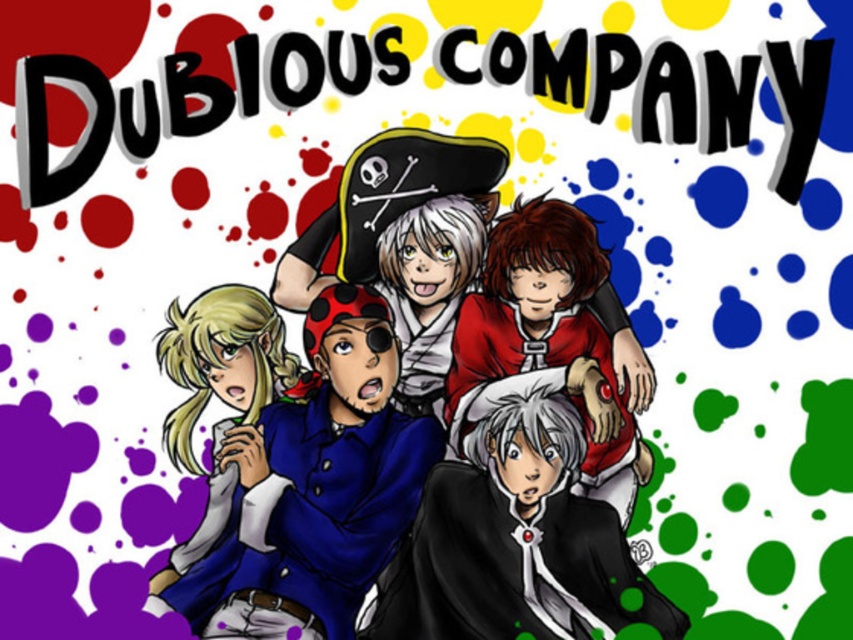
Which is in front, point (440, 429) or point (218, 326)?

Point (218, 326) is more forward.

Is blue fabric shirt at center behind satin blue dress at lower left?

Yes, blue fabric shirt at center is behind satin blue dress at lower left.

You are a GUI agent. You are given a task and a screenshot of the screen. Output one action in this format:
    pyautogui.click(x=<x>, y=<y>)
    Task: Click on the blue fabric shirt at center
    This screenshot has height=640, width=853.
    Given the screenshot: What is the action you would take?
    pyautogui.click(x=309, y=488)

Identify the location of blue fabric shirt at center. [x=309, y=488].

Is smooth black coat at center bigger than smooth red shirt at center?

Yes, smooth black coat at center is bigger than smooth red shirt at center.

Does smooth black coat at center appear over smooth red shirt at center?

Incorrect, smooth black coat at center is not positioned above smooth red shirt at center.

Is point (664, 611) positioned after point (486, 260)?

That is False.

Where is `smooth black coat at center`? Image resolution: width=853 pixels, height=640 pixels. smooth black coat at center is located at coordinates (514, 541).

Is blue fabric shirt at center smaller than smooth black coat at center?

Incorrect, blue fabric shirt at center is not smaller in size than smooth black coat at center.

Does blue fabric shirt at center have a greater height compared to smooth black coat at center?

Yes, blue fabric shirt at center is taller than smooth black coat at center.

Which is behind, point (296, 432) or point (480, 472)?

The point (480, 472) is behind.

Identify the location of blue fabric shirt at center. This screenshot has height=640, width=853. (309, 488).